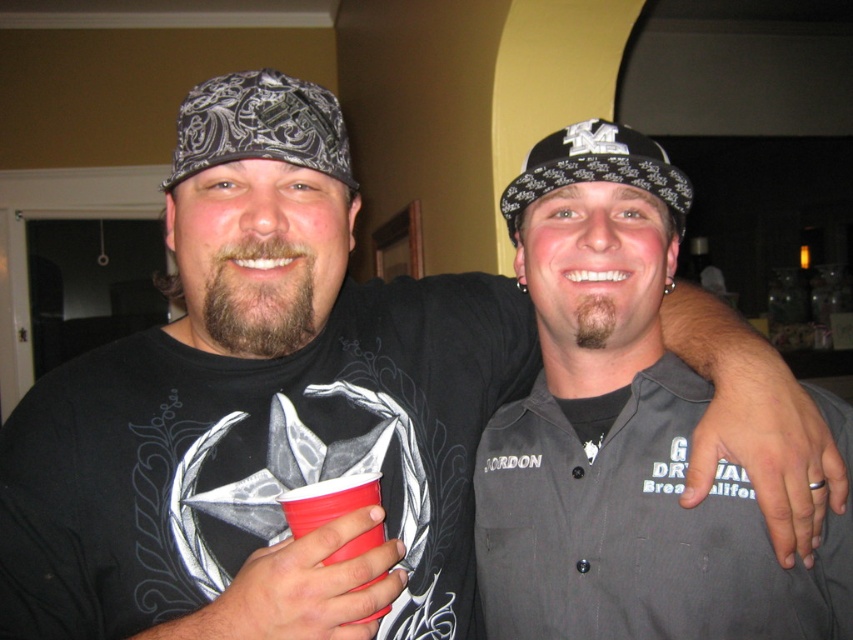
Looking at this image, you are at a party and want to take a photo of the two people standing at point (554, 458) and point (207, 122). Which point is closer to you so that you can focus on them first?

Point (554, 458) is further to the viewer than point (207, 122), so you should focus on point (554, 458) first since it is closer to you.